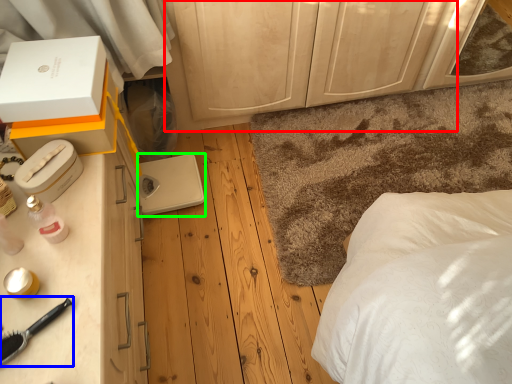
Question: Estimate the real-world distances between objects in this image. Which object is closer to dresser (highlighted by a red box), brush (highlighted by a blue box) or appliance (highlighted by a green box)?

Choices:
 (A) brush
 (B) appliance

Answer: (B)